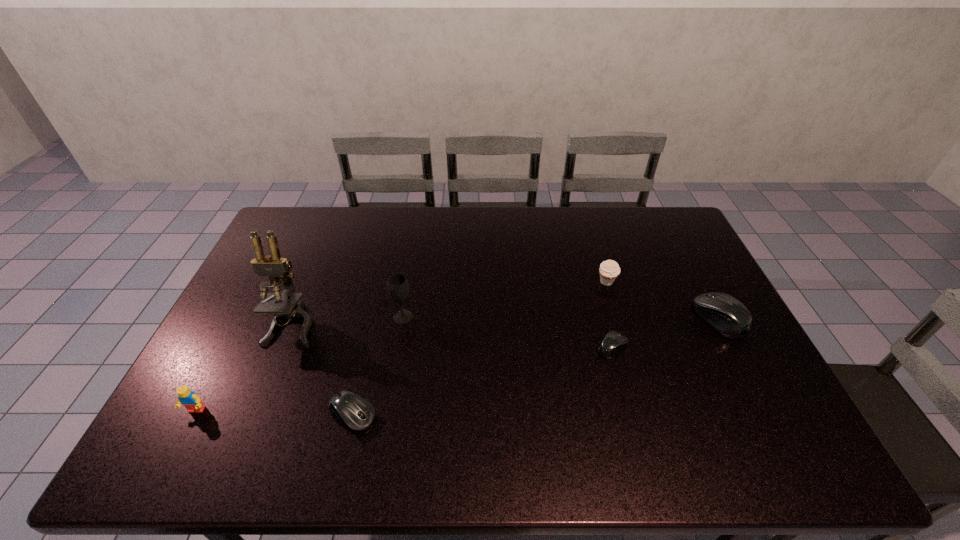
Where is `free point between the leftmost object and the rightmost object`? free point between the leftmost object and the rightmost object is located at coordinates (458, 364).

Image resolution: width=960 pixels, height=540 pixels. In order to click on free spot between the second object from left to right and the leftmost object in this screenshot , I will do `click(245, 367)`.

The width and height of the screenshot is (960, 540). I want to click on empty space between the second mouse from right to left and the rightmost object, so click(665, 333).

Locate an element on the screen. The width and height of the screenshot is (960, 540). vacant area between the leftmost object and the wineglass is located at coordinates (300, 364).

At what (x,y) coordinates should I click in order to perform the action: click on free space between the farthest object and the leftmost object. Please return your answer as a coordinate pair (x, y). Looking at the image, I should click on (401, 346).

Select which object is the second closest to the sixth shortest object. Please provide its 2D coordinates. Your answer should be formatted as a tuple, i.e. [(x, y)], where the tuple contains the x and y coordinates of a point satisfying the conditions above.

[(355, 413)]

This screenshot has width=960, height=540. Find the location of `the second closest object to the leftmost object`. the second closest object to the leftmost object is located at coordinates (355, 413).

Identify which mouse is located as the nearest to the rightmost object. Please provide its 2D coordinates. Your answer should be formatted as a tuple, i.e. [(x, y)], where the tuple contains the x and y coordinates of a point satisfying the conditions above.

[(614, 342)]

Identify which mouse is the second nearest to the rightmost object. Please provide its 2D coordinates. Your answer should be formatted as a tuple, i.e. [(x, y)], where the tuple contains the x and y coordinates of a point satisfying the conditions above.

[(355, 413)]

The image size is (960, 540). What are the coordinates of `vacant point that satisfies the following two spatial constraints: 1. at the eyepieces of the second object from left to right; 2. on the right side of the shortest mouse` in the screenshot? It's located at pos(283,347).